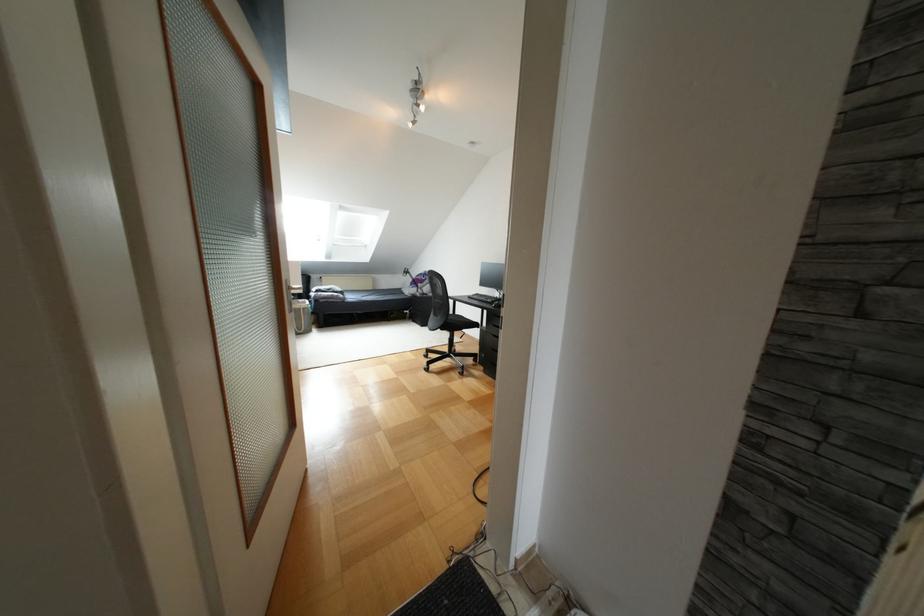
Image resolution: width=924 pixels, height=616 pixels. What do you see at coordinates (456, 322) in the screenshot?
I see `the chair sitting surface` at bounding box center [456, 322].